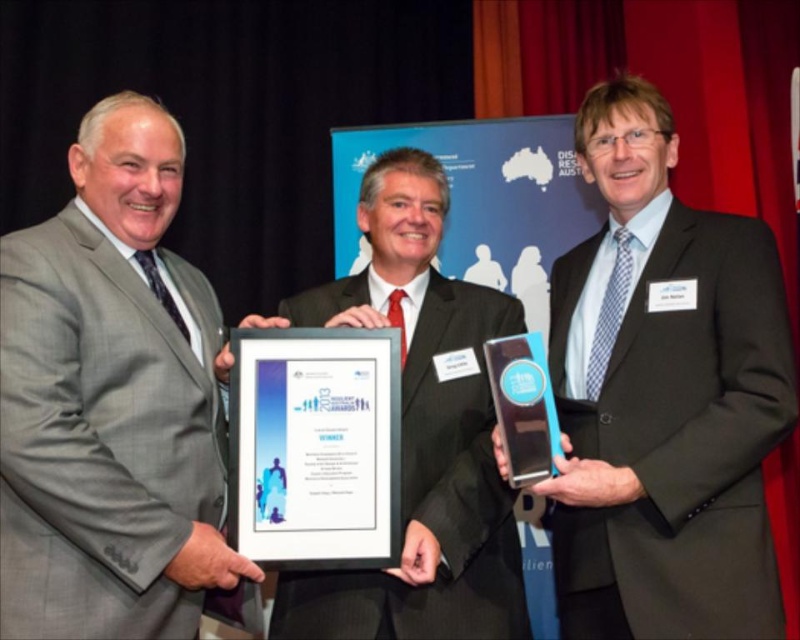
What do you see at coordinates (664, 396) in the screenshot? I see `matte black suit at center` at bounding box center [664, 396].

At what (x,y) coordinates should I click in order to perform the action: click on matte black suit at center. Please return your answer as a coordinate pair (x, y). This screenshot has height=640, width=800. Looking at the image, I should click on (664, 396).